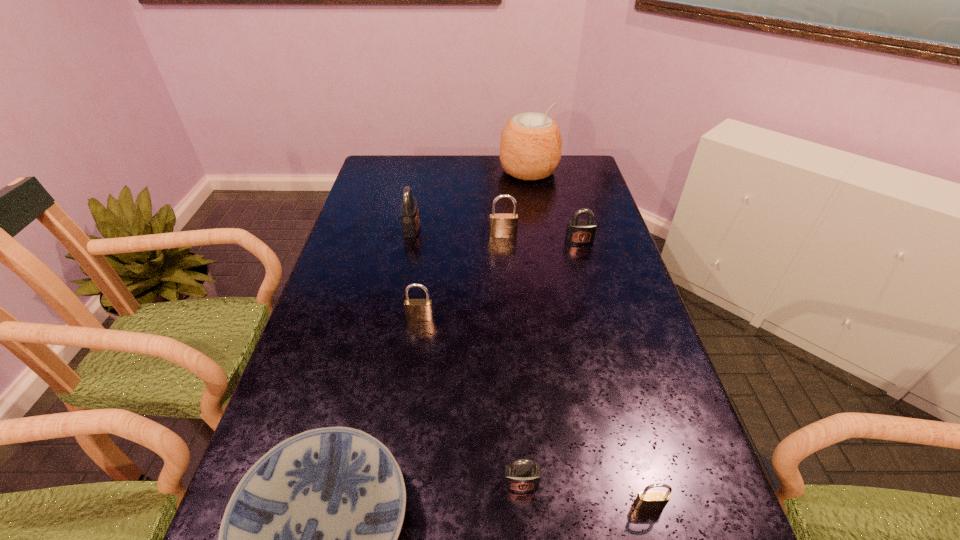
Identify the location of object that is at the far right corner. (530, 148).

Locate an element on the screen. free space at the far edge of the desktop is located at coordinates (434, 180).

The height and width of the screenshot is (540, 960). I want to click on free point at the left edge, so click(x=386, y=192).

The height and width of the screenshot is (540, 960). I want to click on free space at the right edge, so click(592, 282).

I want to click on vacant space at the far left corner of the desktop, so click(363, 182).

Identify the location of free space at the far right corner of the desktop. (590, 178).

Find the location of a particular element. Image resolution: width=960 pixels, height=540 pixels. empty space that is in between the farthest object and the nearest padlock is located at coordinates (588, 339).

Image resolution: width=960 pixels, height=540 pixels. Find the location of `empty location between the nearest padlock and the farthest object`. empty location between the nearest padlock and the farthest object is located at coordinates (x=588, y=339).

Where is `empty location between the fourth nearest object and the coconut`? This screenshot has height=540, width=960. empty location between the fourth nearest object and the coconut is located at coordinates (474, 245).

This screenshot has width=960, height=540. I want to click on empty location between the rightmost gray padlock and the coconut, so click(554, 206).